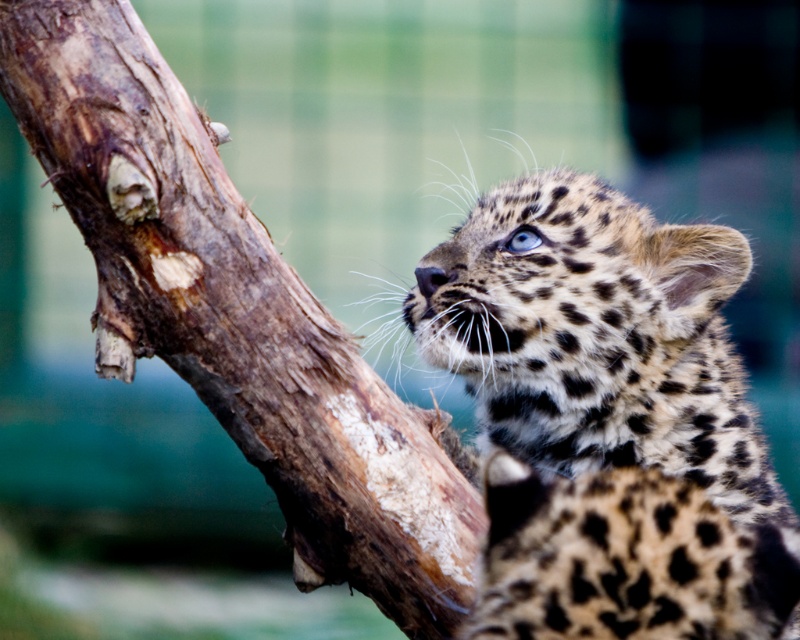
Does spotted fur leopard at upper center have a smaller size compared to brown rough tree trunk at upper left?

Indeed, spotted fur leopard at upper center has a smaller size compared to brown rough tree trunk at upper left.

Who is lower down, spotted fur leopard at upper center or brown rough tree trunk at upper left?

Positioned lower is spotted fur leopard at upper center.

Which is in front, point (544, 248) or point (66, 179)?

Point (66, 179)

This screenshot has width=800, height=640. I want to click on spotted fur leopard at upper center, so click(x=608, y=417).